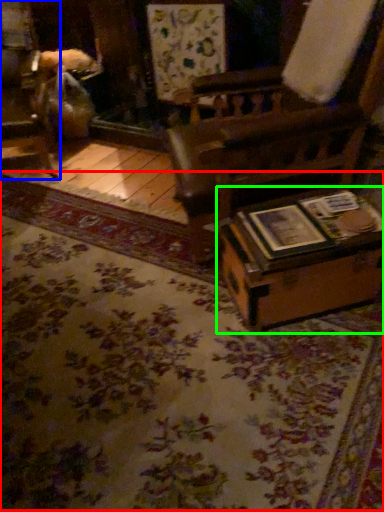
Question: Considering the real-world distances, which object is farthest from mat (highlighted by a red box)? furniture (highlighted by a blue box) or table (highlighted by a green box)?

Choices:
 (A) furniture
 (B) table

Answer: (A)